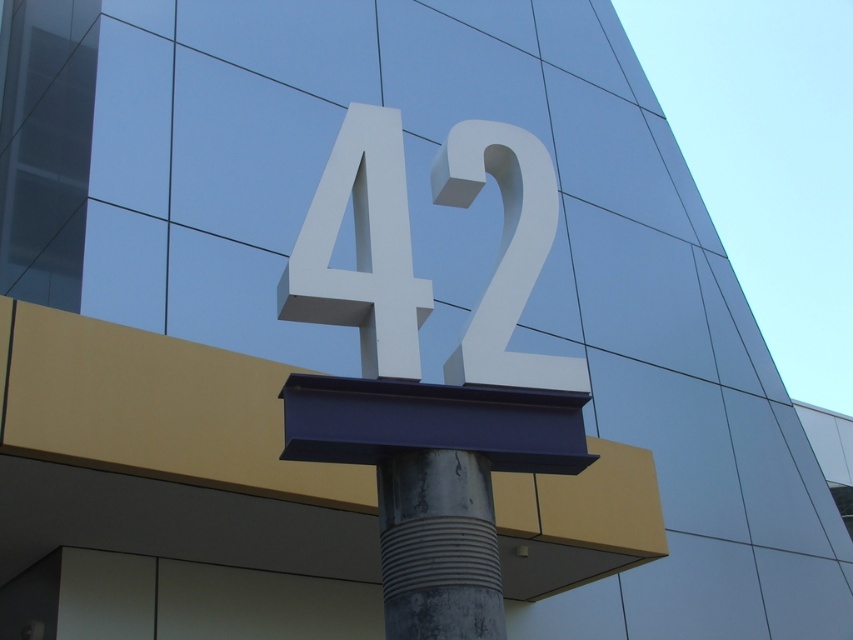
You are standing in front of the large 3D number display. There is a point marked at coordinates (x=438, y=547). Based on the scene description, can you determine what object this point is located on?

The point at coordinates (x=438, y=547) is located on the rusty metallic pole at center.

You are an architect designing a new sign for a building. The existing sign has the white matte number at center and a rusty metallic pole at center. You need to ensure the new sign will fit within the same space. Which object should you consider the size of to ensure compatibility?

You should consider the size of the white matte number at center because its width is larger than the rusty metallic pole at center, so designing around its dimensions will ensure the new sign fits within the existing space.

You are standing in front of the building with the large number 42. You notice two points marked on the base of the number. The first point is at coordinates point (294,257) and the second is at point (552,240). From your perspective, which point is closer to you?

Point (294,257) is in front of point (552,240), so it is closer to you.